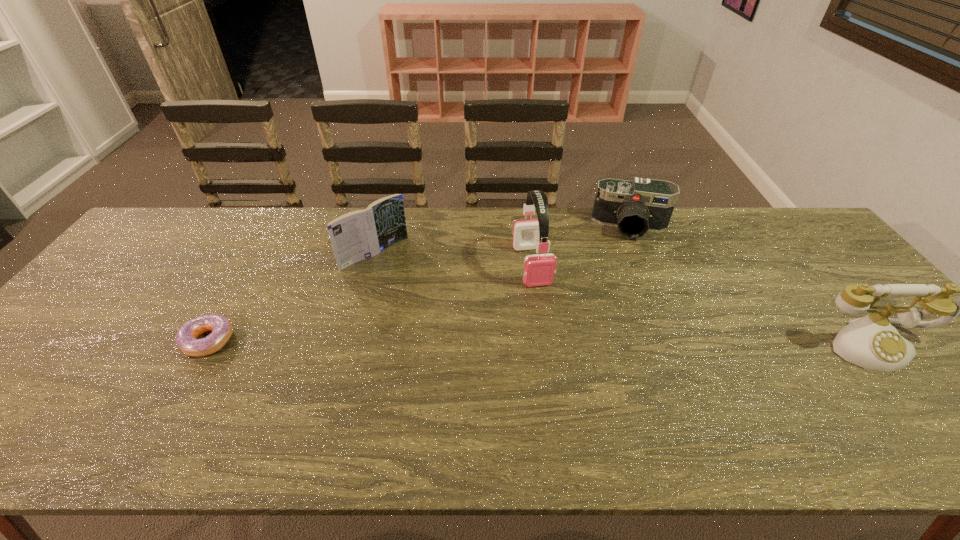
The width and height of the screenshot is (960, 540). Find the location of `free spot between the shortest object and the telephone`. free spot between the shortest object and the telephone is located at coordinates (540, 343).

I want to click on vacant area that lies between the earphone and the leftmost object, so click(x=371, y=303).

Where is `vacant space that is in between the second shortest object and the rightmost object`? vacant space that is in between the second shortest object and the rightmost object is located at coordinates (752, 286).

Find the location of a particular element. Image resolution: width=960 pixels, height=540 pixels. free point between the fourth tallest object and the telephone is located at coordinates (752, 286).

The width and height of the screenshot is (960, 540). I want to click on free space between the book and the rightmost object, so click(x=624, y=300).

You are a GUI agent. You are given a task and a screenshot of the screen. Output one action in this format:
    pyautogui.click(x=<x>, y=<y>)
    Task: Click on the free space that is in between the earphone and the rightmost object
    The height and width of the screenshot is (540, 960).
    Given the screenshot: What is the action you would take?
    [702, 305]

Locate an element on the screen. This screenshot has height=540, width=960. blank region between the fourth object from left to right and the shortest object is located at coordinates (420, 284).

The width and height of the screenshot is (960, 540). Identify the location of object identified as the second closest to the third object from left to right. (361, 234).

Identify which object is the second closest to the second object from left to right. Please provide its 2D coordinates. Your answer should be formatted as a tuple, i.e. [(x, y)], where the tuple contains the x and y coordinates of a point satisfying the conditions above.

[(539, 269)]

Locate an element on the screen. free point that satisfies the following two spatial constraints: 1. on the back side of the second object from right to left; 2. on the left side of the shortest object is located at coordinates (275, 226).